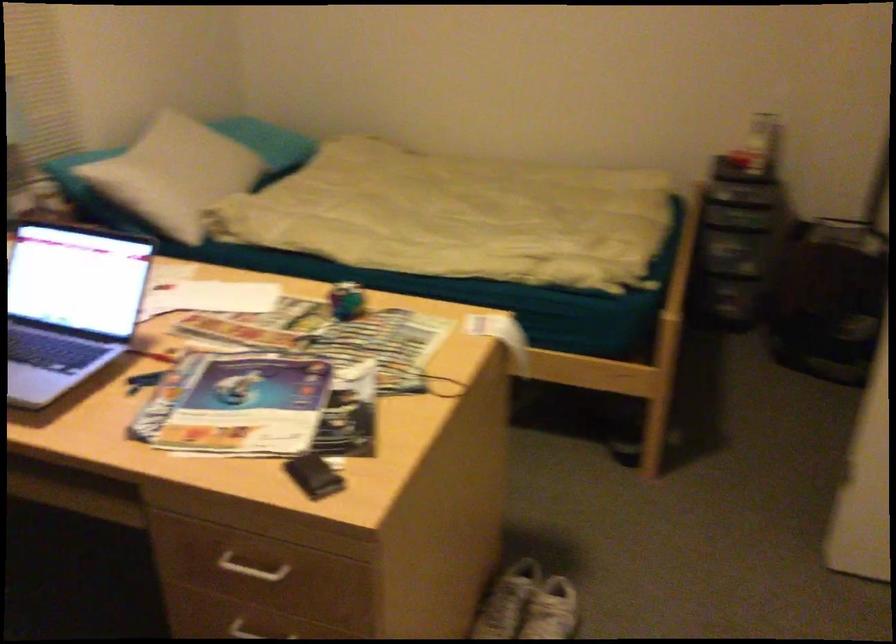
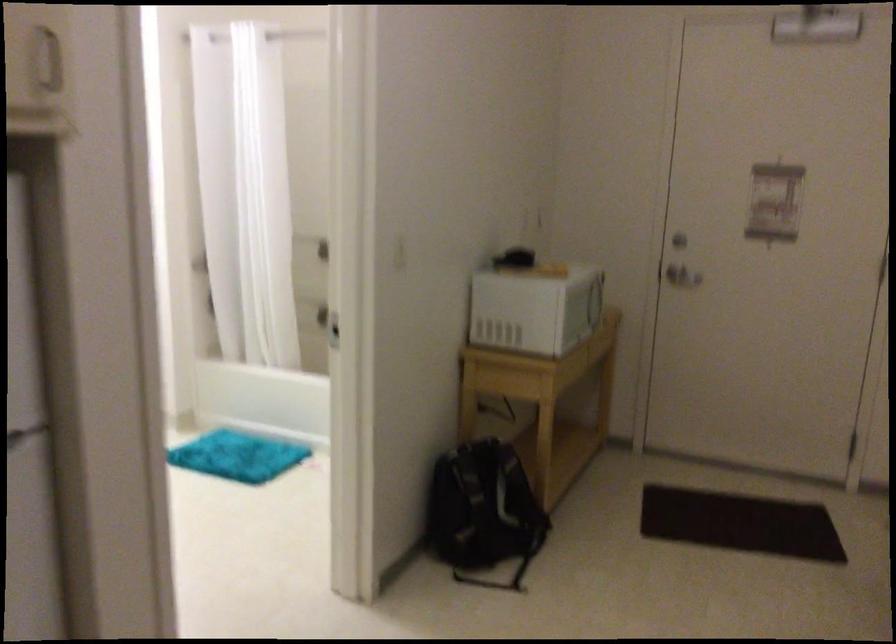
Question: The first image is from the beginning of the video and the second image is from the end. How did the camera likely rotate when shooting the video?

Choices:
 (A) Left
 (B) Right
 (C) Up
 (D) Down

Answer: (B)